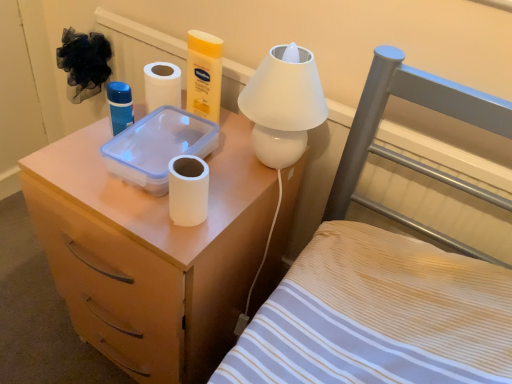
Question: From the image's perspective, would you say wooden nightstand at center-left is positioned over matte plastic container at upper center?

Choices:
 (A) yes
 (B) no

Answer: (A)

Question: Can you confirm if wooden nightstand at center-left is positioned to the left of matte plastic container at upper center?

Choices:
 (A) yes
 (B) no

Answer: (B)

Question: Is wooden nightstand at center-left shorter than matte plastic container at upper center?

Choices:
 (A) no
 (B) yes

Answer: (A)

Question: Is wooden nightstand at center-left in front of matte plastic container at upper center?

Choices:
 (A) yes
 (B) no

Answer: (B)

Question: From a real-world perspective, is wooden nightstand at center-left on top of matte plastic container at upper center?

Choices:
 (A) yes
 (B) no

Answer: (A)

Question: Can we say wooden nightstand at center-left lies outside matte plastic container at upper center?

Choices:
 (A) no
 (B) yes

Answer: (B)

Question: Can you see white glossy table lamp at upper center touching wooden nightstand at center-left?

Choices:
 (A) yes
 (B) no

Answer: (B)

Question: Is white glossy table lamp at upper center turned away from wooden nightstand at center-left?

Choices:
 (A) no
 (B) yes

Answer: (A)

Question: From the image's perspective, does white glossy table lamp at upper center appear lower than wooden nightstand at center-left?

Choices:
 (A) yes
 (B) no

Answer: (B)

Question: Is white glossy table lamp at upper center at the left side of wooden nightstand at center-left?

Choices:
 (A) yes
 (B) no

Answer: (B)

Question: Does white glossy table lamp at upper center have a lesser width compared to wooden nightstand at center-left?

Choices:
 (A) no
 (B) yes

Answer: (A)

Question: Considering the relative positions of white glossy table lamp at upper center and wooden nightstand at center-left in the image provided, is white glossy table lamp at upper center to the right of wooden nightstand at center-left from the viewer's perspective?

Choices:
 (A) no
 (B) yes

Answer: (B)

Question: Can you confirm if white matte toilet paper at center is thinner than wooden nightstand at center-left?

Choices:
 (A) yes
 (B) no

Answer: (A)